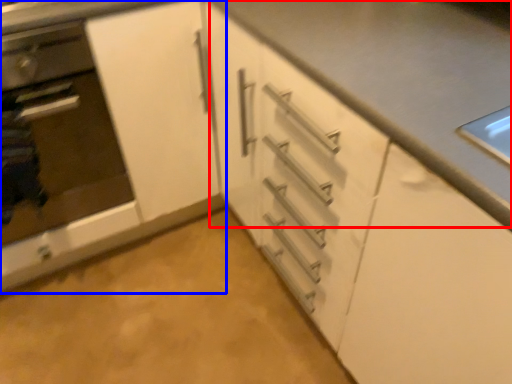
Question: Which object is closer to the camera taking this photo, counter top (highlighted by a red box) or cabinetry (highlighted by a blue box)?

Choices:
 (A) counter top
 (B) cabinetry

Answer: (A)